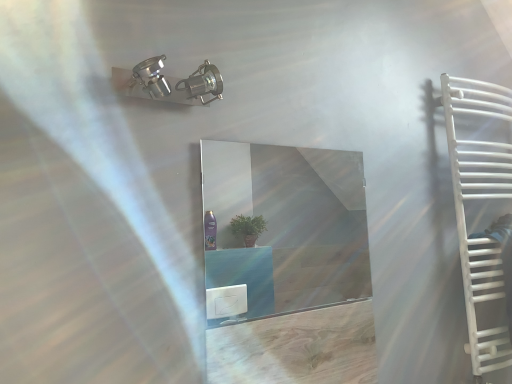
Question: Does white plastic stairs at right touch white matte towel rack at right?

Choices:
 (A) no
 (B) yes

Answer: (A)

Question: Is white plastic stairs at right closer to the viewer compared to white matte towel rack at right?

Choices:
 (A) no
 (B) yes

Answer: (A)

Question: From the image's perspective, is white plastic stairs at right located beneath white matte towel rack at right?

Choices:
 (A) yes
 (B) no

Answer: (A)

Question: Considering the relative sizes of white plastic stairs at right and white matte towel rack at right in the image provided, is white plastic stairs at right shorter than white matte towel rack at right?

Choices:
 (A) no
 (B) yes

Answer: (B)

Question: From a real-world perspective, is white plastic stairs at right positioned under white matte towel rack at right based on gravity?

Choices:
 (A) no
 (B) yes

Answer: (B)

Question: From a real-world perspective, is white plastic stairs at right physically located above or below white matte towel rack at right?

Choices:
 (A) below
 (B) above

Answer: (A)

Question: Would you say white plastic stairs at right is to the left or to the right of white matte towel rack at right in the picture?

Choices:
 (A) left
 (B) right

Answer: (A)

Question: Considering the positions of white plastic stairs at right and white matte towel rack at right in the image, is white plastic stairs at right wider or thinner than white matte towel rack at right?

Choices:
 (A) wide
 (B) thin

Answer: (B)

Question: Would you say white plastic stairs at right is inside or outside white matte towel rack at right?

Choices:
 (A) inside
 (B) outside

Answer: (A)

Question: Considering the positions of white matte towel rack at right and white plastic stairs at right in the image, is white matte towel rack at right bigger or smaller than white plastic stairs at right?

Choices:
 (A) big
 (B) small

Answer: (A)

Question: From the image's perspective, is white matte towel rack at right above or below white plastic stairs at right?

Choices:
 (A) above
 (B) below

Answer: (A)

Question: In the image, is white matte towel rack at right positioned in front of or behind white plastic stairs at right?

Choices:
 (A) behind
 (B) front

Answer: (B)

Question: From a real-world perspective, relative to white plastic stairs at right, is white matte towel rack at right vertically above or below?

Choices:
 (A) above
 (B) below

Answer: (A)

Question: From the image's perspective, is white plastic stairs at right located above or below clear glass mirror at center?

Choices:
 (A) above
 (B) below

Answer: (B)

Question: Visually, is white plastic stairs at right positioned to the left or to the right of clear glass mirror at center?

Choices:
 (A) left
 (B) right

Answer: (B)